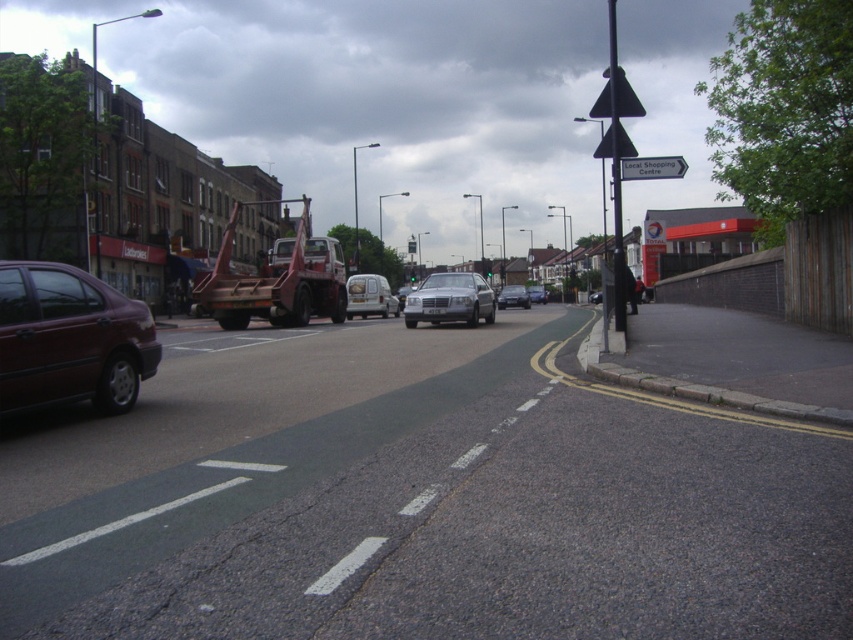
From the picture: You are a pedestrian standing on the sidewalk and see the matte maroon sedan at left and the metallic silver van at center. Which vehicle is closer to you?

The matte maroon sedan at left is closer to you because it is in front of the metallic silver van at center, meaning it is nearer to your position on the sidewalk.

You are a delivery driver needing to park your vehicle in the green bus lane on the left side of the road. There is a matte maroon sedan at left. Can you park there without blocking the sedan?

The matte maroon sedan at left is already located at point (70, 339), so you cannot park there without blocking it.

You are a pedestrian standing at the edge of the road near the tow truck. You see the metallic silver van at center and the satin silver sedan at center. Which vehicle is closer to you?

The metallic silver van at center is closer to you since it is only 15.96 meters away from the satin silver sedan at center, which is further away.